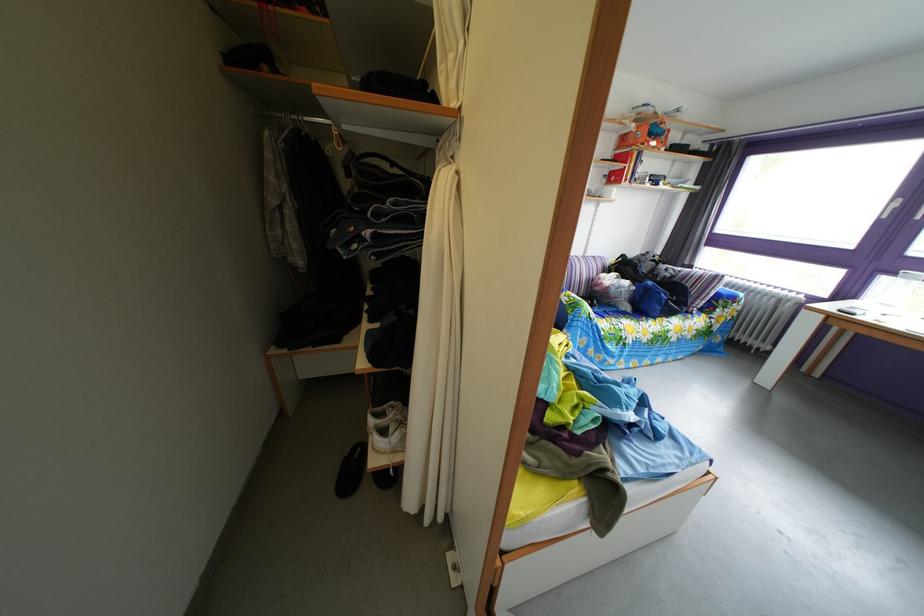
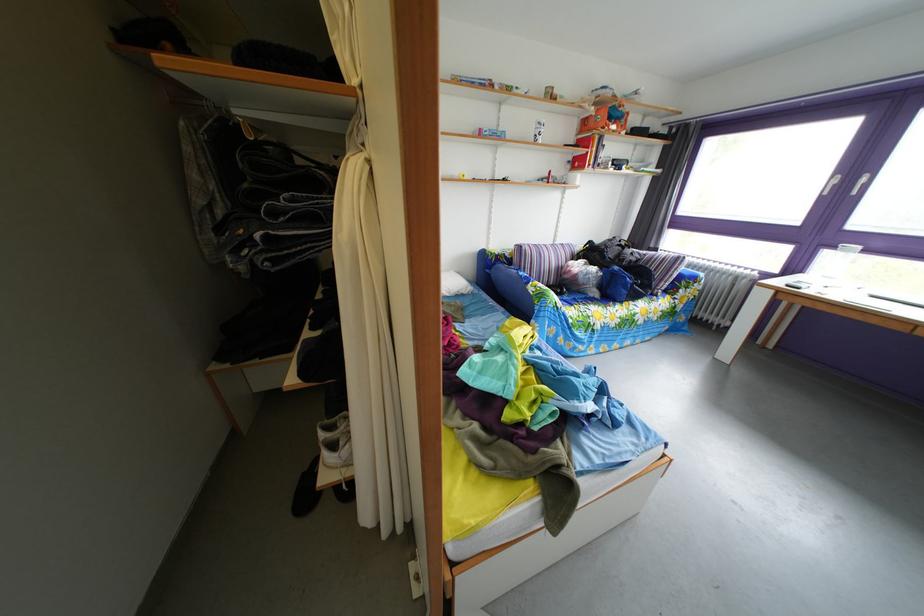
Consider the image. Which direction would the cameraman need to move to produce the second image?

The cameraman moved toward right, forward.